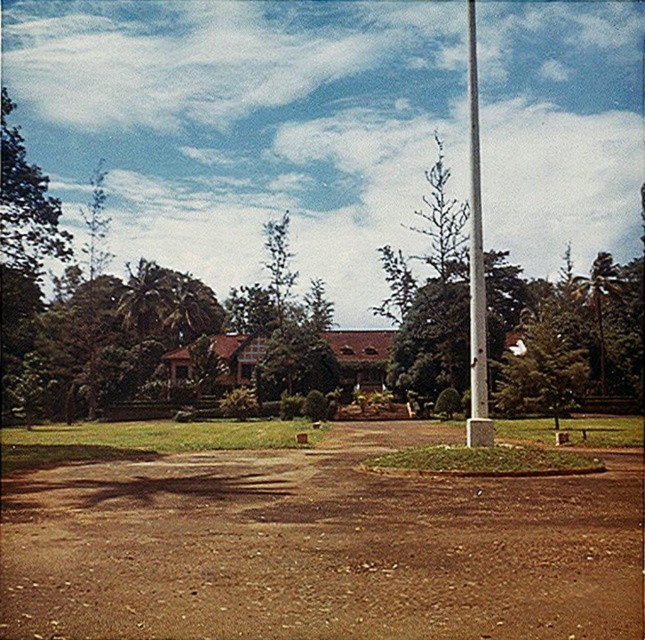
Question: Which point is farther to the camera?

Choices:
 (A) brown dirt field at center
 (B) white smooth pole at center
 (C) green leafy tree at center
 (D) green textured tree at center

Answer: (D)

Question: Considering the real-world distances, which object is farthest from the brown dirt field at center?

Choices:
 (A) green textured tree at center
 (B) white smooth pole at center
 (C) green leafy tree at center

Answer: (C)

Question: Which object is the closest to the green leafy tree at center?

Choices:
 (A) white smooth pole at center
 (B) green textured tree at center

Answer: (A)

Question: Where is green leafy tree at center located in relation to green textured tree at center in the image?

Choices:
 (A) right
 (B) left

Answer: (B)

Question: Is brown dirt field at center bigger than white smooth pole at center?

Choices:
 (A) no
 (B) yes

Answer: (A)

Question: Does brown dirt field at center have a lesser width compared to green leafy tree at center?

Choices:
 (A) yes
 (B) no

Answer: (A)